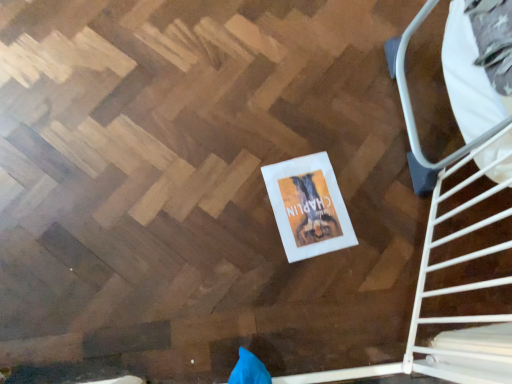
This screenshot has height=384, width=512. In order to click on free area behind white metal gate at upper right in this screenshot , I will do `click(371, 157)`.